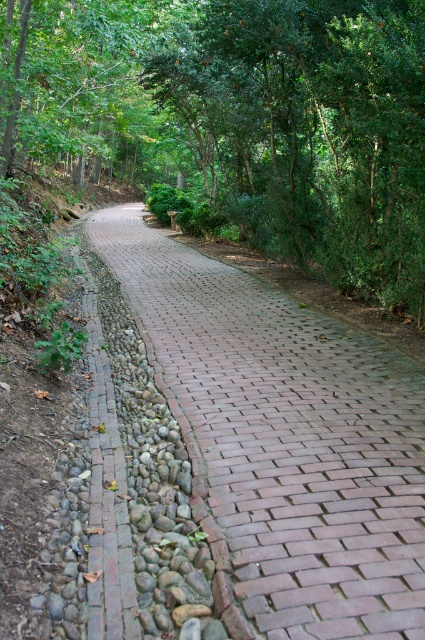
Based on the photo, is green leafy forest at center wider than brick paved path at center?

Result: Correct, the width of green leafy forest at center exceeds that of brick paved path at center.

Is green leafy forest at center positioned at the back of brick paved path at center?

No, green leafy forest at center is in front of brick paved path at center.

Is point (362, 188) positioned after point (167, 392)?

Yes, point (362, 188) is behind point (167, 392).

Find the location of a particular element. The height and width of the screenshot is (640, 425). green leafy forest at center is located at coordinates (240, 116).